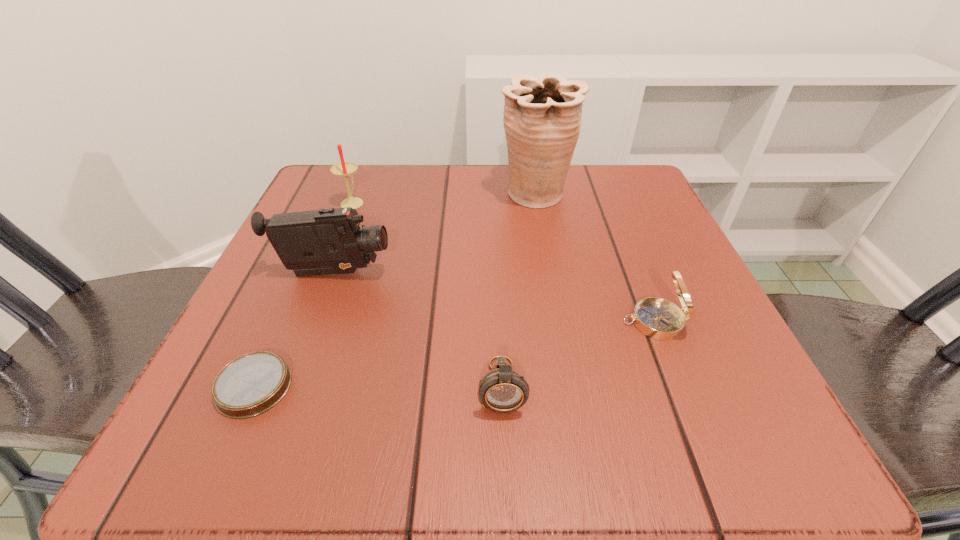
This screenshot has width=960, height=540. I want to click on the tallest object, so click(542, 116).

The height and width of the screenshot is (540, 960). In order to click on candle in this screenshot , I will do `click(345, 169)`.

Find the location of a particular element. camcorder is located at coordinates (327, 241).

Find the location of a particular element. This screenshot has height=540, width=960. the fourth farthest object is located at coordinates (658, 318).

This screenshot has width=960, height=540. What are the coordinates of `the rightmost compass` in the screenshot? It's located at (658, 318).

Where is `the second compass from left to right`? The image size is (960, 540). the second compass from left to right is located at coordinates (502, 390).

Locate an element on the screen. Image resolution: width=960 pixels, height=540 pixels. the shortest object is located at coordinates (250, 385).

Locate an element on the screen. This screenshot has width=960, height=540. the shortest compass is located at coordinates (250, 385).

Locate an element on the screen. This screenshot has height=540, width=960. vacant space located 0.140m on the left of the urn is located at coordinates (432, 195).

This screenshot has width=960, height=540. In order to click on free space located on the right of the candle in this screenshot , I will do `click(408, 202)`.